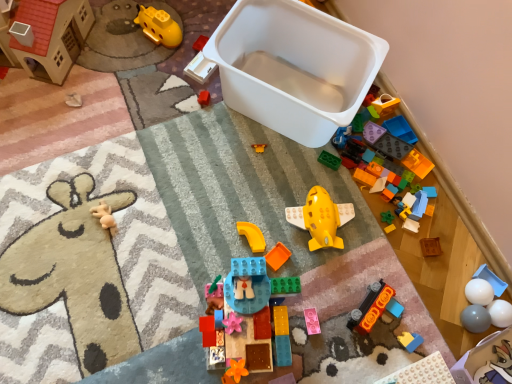
Where is `free area in between white plastic storage box at upper center, the 1th storage box when ordered from left to right, and orange matte block at center, the 11th toy from the right`? free area in between white plastic storage box at upper center, the 1th storage box when ordered from left to right, and orange matte block at center, the 11th toy from the right is located at coordinates (261, 176).